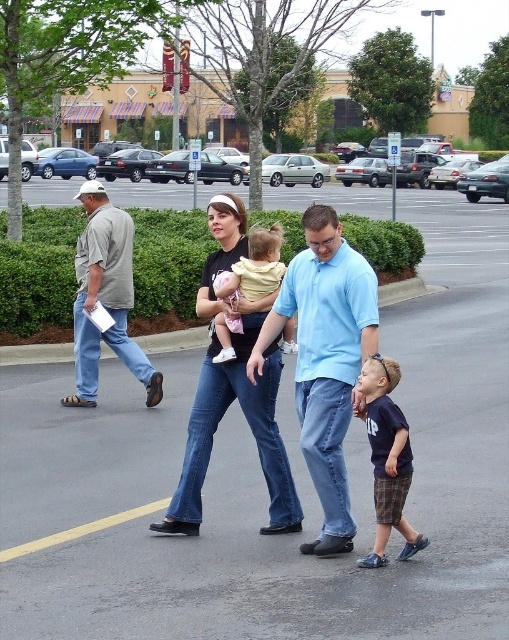
Can you confirm if gray cotton shirt at left is wider than navy blue t-shirt at center?

Yes.

Who is lower down, gray cotton shirt at left or navy blue t-shirt at center?

navy blue t-shirt at center is below.

You are a GUI agent. You are given a task and a screenshot of the screen. Output one action in this format:
    pyautogui.click(x=<x>, y=<y>)
    Task: Click on the gray cotton shirt at left
    
    Given the screenshot: What is the action you would take?
    [x=105, y=298]

In order to click on gray cotton shirt at left in this screenshot , I will do `click(105, 298)`.

Can you confirm if light blue cotton shirt at center is wider than yellow cotton shirt at center?

Indeed, light blue cotton shirt at center has a greater width compared to yellow cotton shirt at center.

Is point (343, 369) closer to viewer compared to point (243, 288)?

Yes, it is in front of point (243, 288).

Does point (331, 262) come in front of point (254, 253)?

Yes.

I want to click on light blue cotton shirt at center, so click(325, 358).

Which is more to the right, black cotton shirt at center or navy blue t-shirt at center?

Positioned to the right is navy blue t-shirt at center.

Does black cotton shirt at center appear over navy blue t-shirt at center?

Yes, black cotton shirt at center is above navy blue t-shirt at center.

Is point (269, 376) positioned before point (382, 538)?

No, it is behind (382, 538).

Where is `black cotton shirt at center`? black cotton shirt at center is located at coordinates (247, 422).